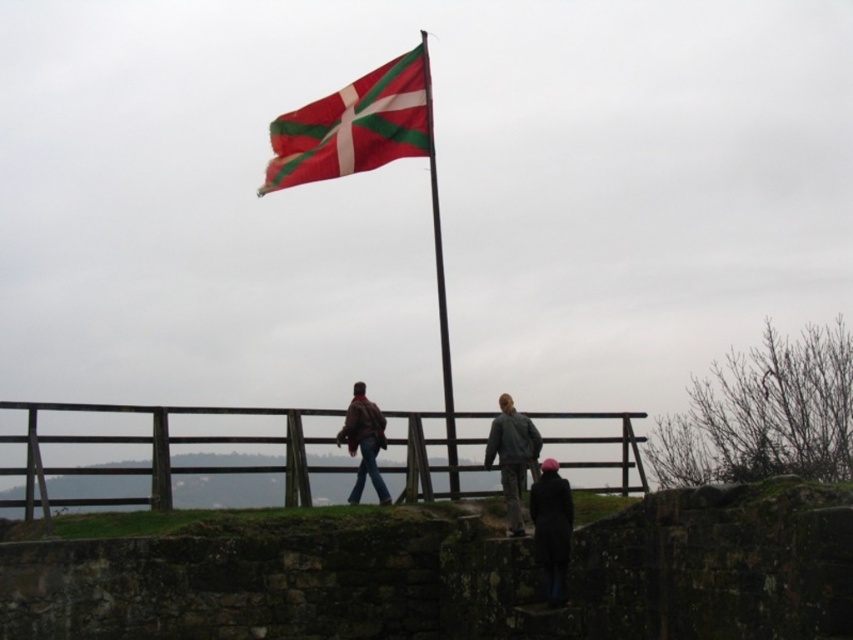
Is point (563, 544) farther from camera compared to point (381, 500)?

No, (563, 544) is closer to viewer.

Consider the image. Is dark gray jacket at lower center to the left of leather jacket at center from the viewer's perspective?

In fact, dark gray jacket at lower center is to the right of leather jacket at center.

Who is more distant from viewer, (556,560) or (360,397)?

The point (360,397) is more distant.

The width and height of the screenshot is (853, 640). I want to click on dark gray jacket at lower center, so click(x=550, y=529).

Does brown wooden fence at lower center appear over smooth metal pole at center?

Actually, brown wooden fence at lower center is below smooth metal pole at center.

Can you confirm if brown wooden fence at lower center is wider than smooth metal pole at center?

Correct, the width of brown wooden fence at lower center exceeds that of smooth metal pole at center.

At what (x,y) coordinates should I click in order to perform the action: click on brown wooden fence at lower center. Please return your answer as a coordinate pair (x, y). This screenshot has width=853, height=640. Looking at the image, I should click on (164, 458).

Locate an element on the screen. The height and width of the screenshot is (640, 853). brown wooden fence at lower center is located at coordinates (164, 458).

Is point (535, 525) farther from viewer compared to point (424, 44)?

No, (535, 525) is in front of (424, 44).

Between point (534, 531) and point (450, 492), which one is positioned in front?

Point (534, 531) is more forward.

Where is `dark gray jacket at lower center`? dark gray jacket at lower center is located at coordinates (550, 529).